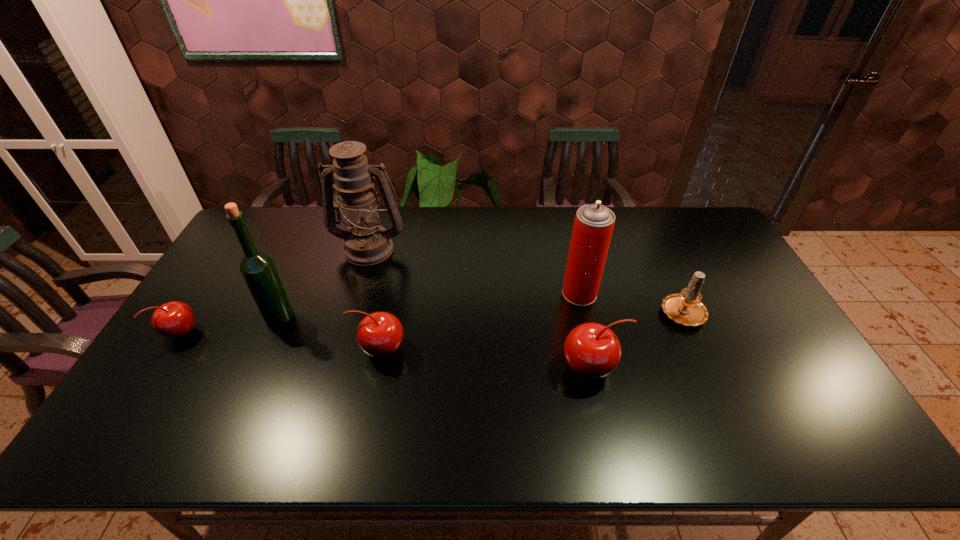
In order to click on object that stands as the sixth closest to the rightmost cherry in this screenshot , I will do `click(174, 319)`.

Find the location of `cherry identified as the second closest to the second tallest cherry`. cherry identified as the second closest to the second tallest cherry is located at coordinates (174, 319).

Locate an element on the screen. the second closest cherry to the aerosol can is located at coordinates (379, 334).

You are a GUI agent. You are given a task and a screenshot of the screen. Output one action in this format:
    pyautogui.click(x=<x>, y=<y>)
    Task: Click on the vacant area that satisfies the following two spatial constraints: 1. on the back side of the liquor; 2. on the left side of the candle
    
    Given the screenshot: What is the action you would take?
    pyautogui.click(x=282, y=312)

The width and height of the screenshot is (960, 540). What are the coordinates of `vacant space that satisfies the following two spatial constraints: 1. on the back side of the aerosol can; 2. on the left side of the rightmost cherry` in the screenshot? It's located at (575, 293).